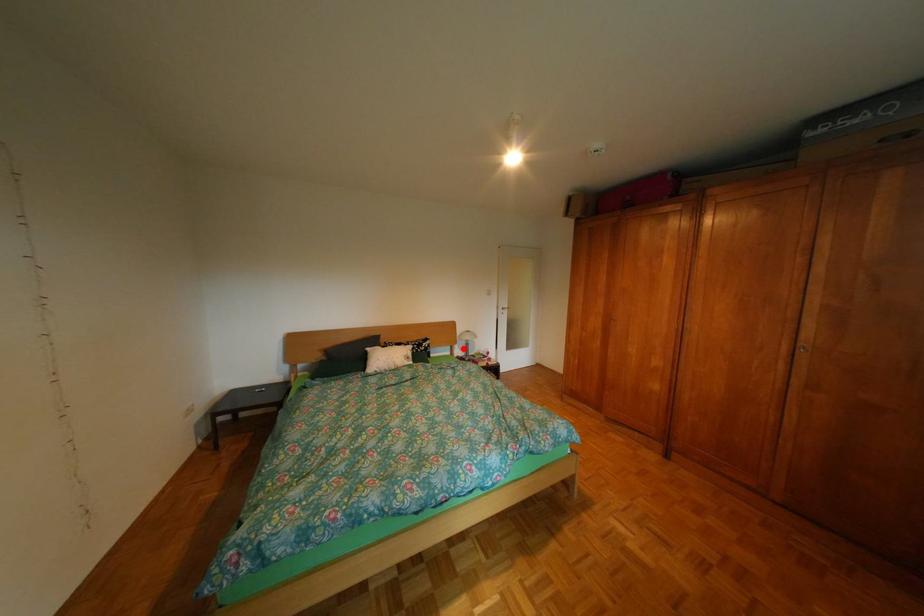
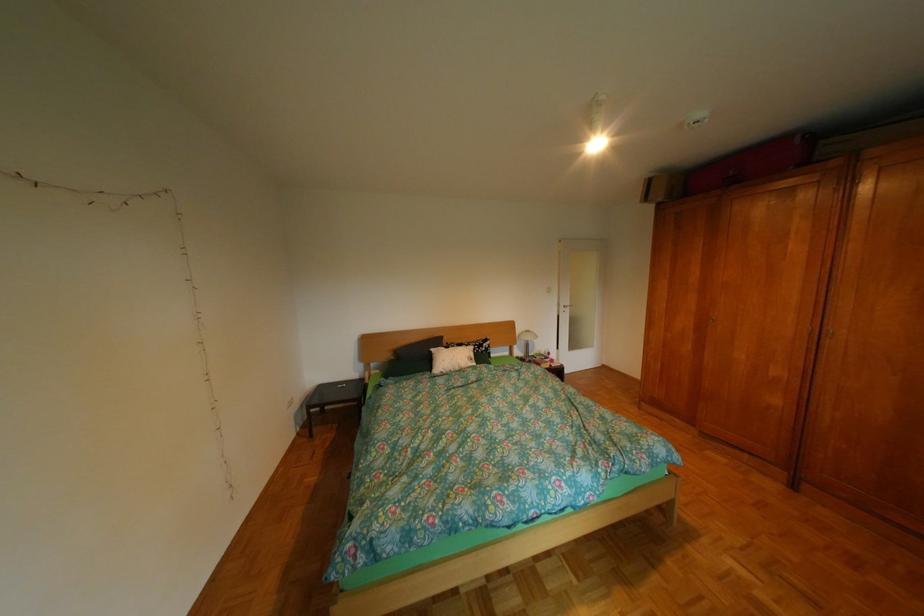
In the second image, find the point that corresponds to the highlighted location in the first image.

(523, 349)